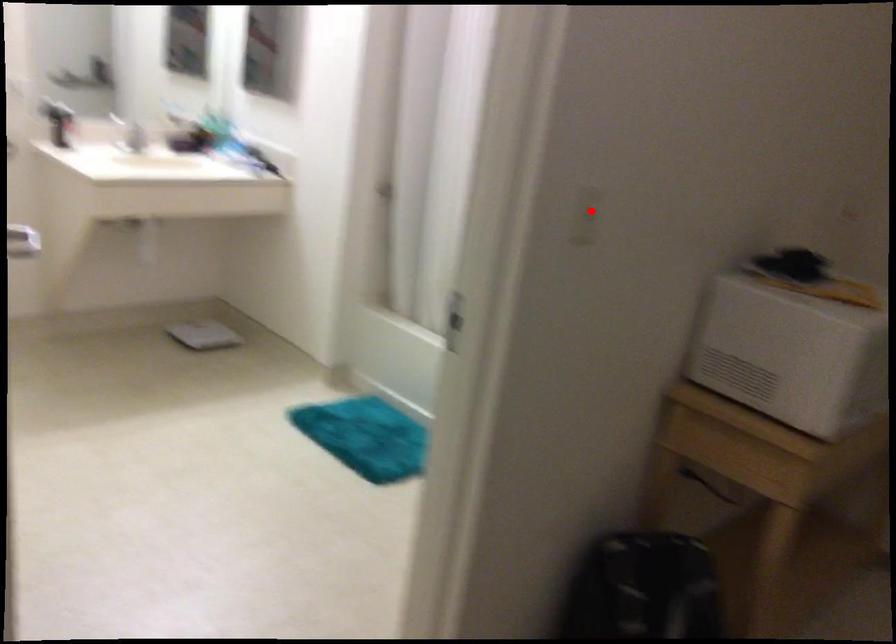
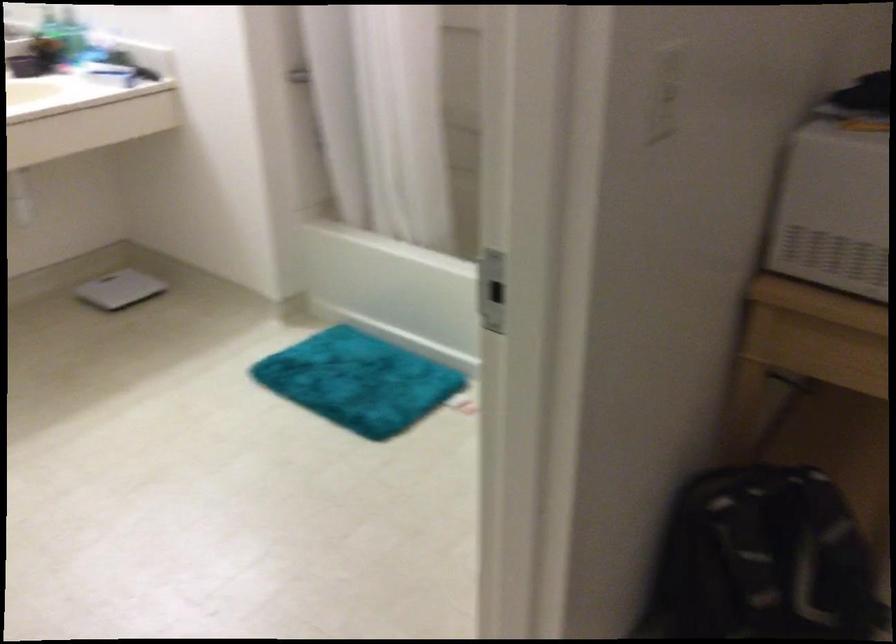
Question: A red point is marked in image1. In image2, is the corresponding 3D point closer to the camera or farther? Reply with the corresponding letter.

Choices:
 (A) The corresponding 3D point is closer.
 (B) The corresponding 3D point is farther.

Answer: (A)